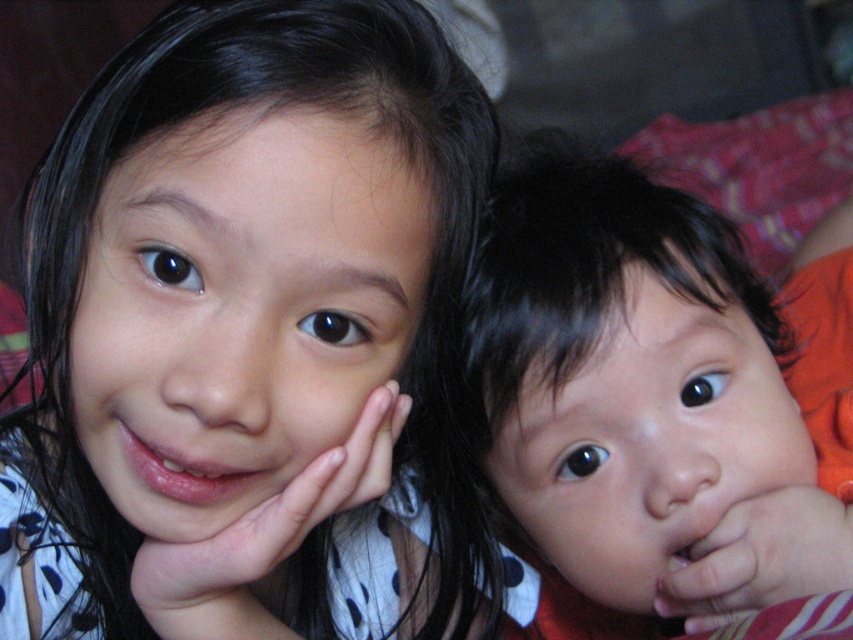
Question: Which of the following is the closest to the observer?

Choices:
 (A) smooth skin baby at center
 (B) pink matte hand at lower left
 (C) smooth skin hand at lower right
 (D) smooth skin face at center

Answer: (D)

Question: Can you confirm if smooth skin face at center is wider than smooth skin hand at lower right?

Choices:
 (A) no
 (B) yes

Answer: (B)

Question: Is smooth skin baby at center to the left of smooth skin hand at lower right from the viewer's perspective?

Choices:
 (A) no
 (B) yes

Answer: (B)

Question: Is smooth skin face at center to the right of smooth skin baby at center from the viewer's perspective?

Choices:
 (A) yes
 (B) no

Answer: (B)

Question: Which of the following is the farthest from the observer?

Choices:
 (A) smooth skin face at center
 (B) smooth skin baby at center
 (C) pink matte hand at lower left
 (D) smooth skin hand at lower right

Answer: (B)

Question: Which object is positioned farthest from the smooth skin hand at lower right?

Choices:
 (A) smooth skin face at center
 (B) smooth skin baby at center

Answer: (A)